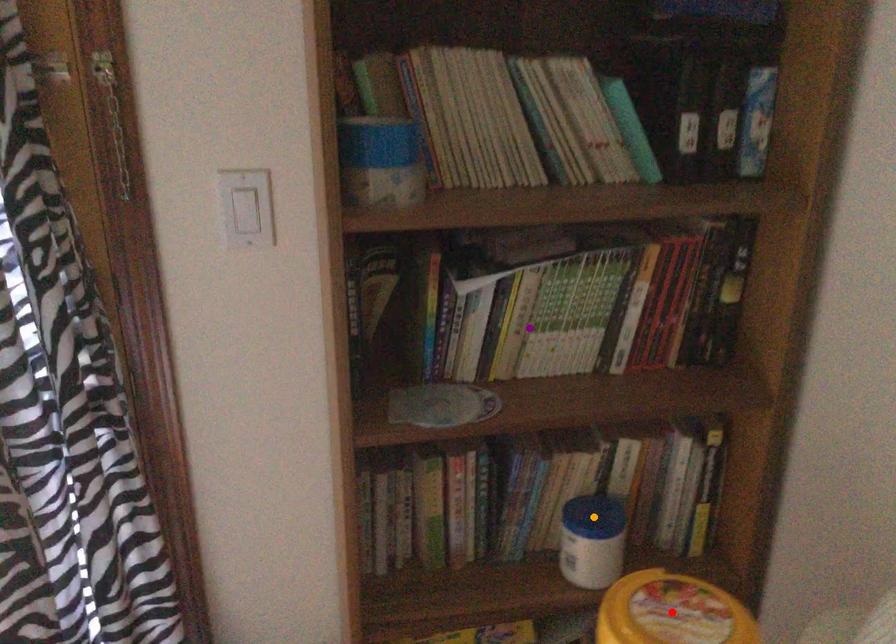
Order these from nearest to farthest:
orange point, red point, purple point

orange point, purple point, red point